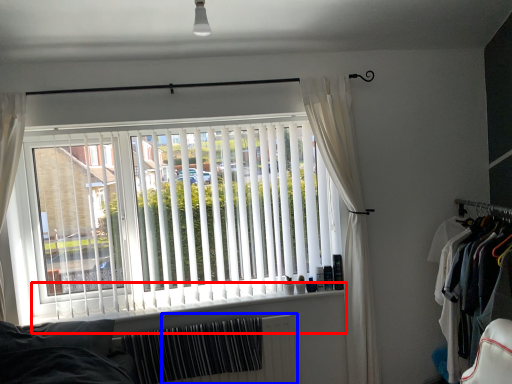
Question: Which point is further to the camera, window sill (highlighted by a red box) or radiator (highlighted by a blue box)?

Choices:
 (A) window sill
 (B) radiator

Answer: (B)